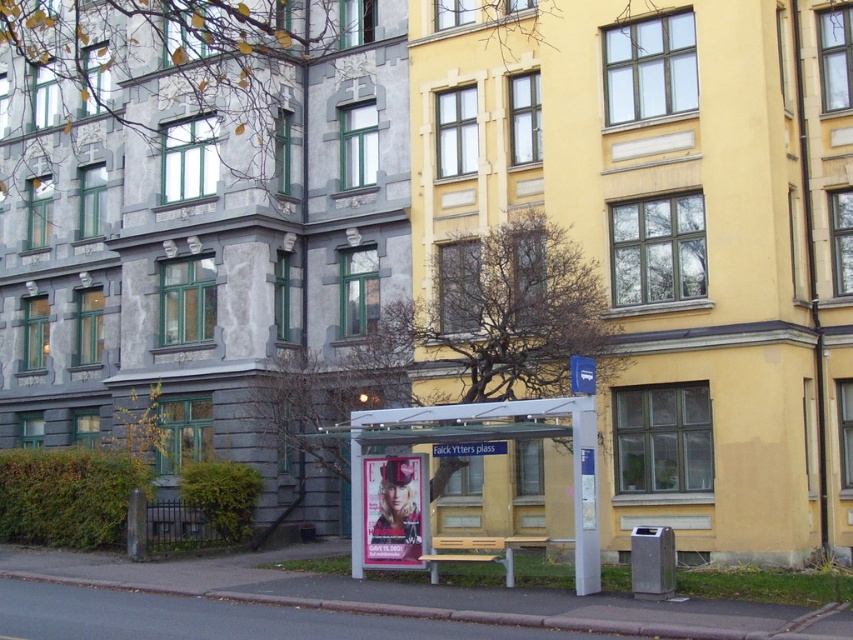
You are a delivery person carrying a package that is 5 feet long. You need to place it between the metallic silver bus stop at center and the matte plastic poster at center. Is there enough space to fit the package between them?

The distance between the metallic silver bus stop at center and the matte plastic poster at center is 4.78 feet, which is shorter than the 5 feet long package. Therefore, there is not enough space to fit the package between them.

You are at the bus stop shelter labeled Falck Ytters plass. There are two points marked on the ground in front of you. The first point is at coordinates point (578,586) and the second point is at point (584,385). Which point is closer to the building on the right?

Point (578,586) is in front of point (584,385), so the first point is closer to the building on the right.